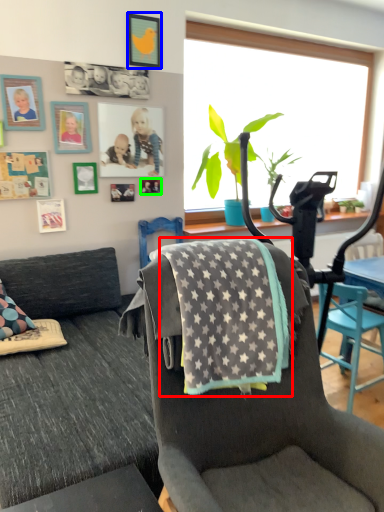
Question: Which object is the closest to the blanket (highlighted by a red box)? Choose among these: picture frame (highlighted by a blue box) or picture frame (highlighted by a green box).

Choices:
 (A) picture frame
 (B) picture frame

Answer: (B)